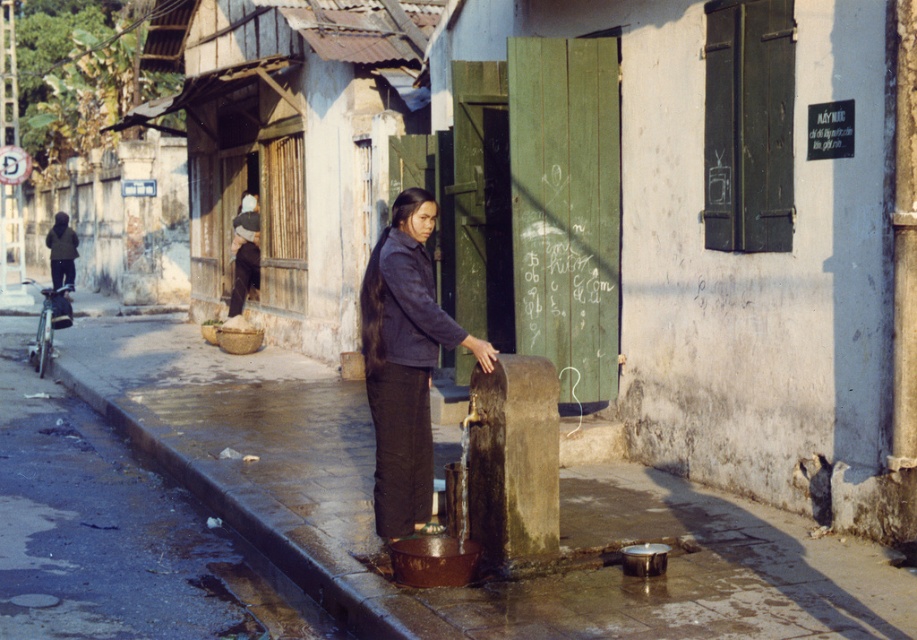
You are standing at point (429, 196) and want to walk to point (290, 380). Which direction should you move in relative to the street scene?

You should move backward because point (290, 380) is behind point (429, 196) in the street scene.

You are a traveler carrying a 1.2 meter tall backpack and need to place it near the rusty metal bucket at center and dark blue fabric jacket at center. Which object should you place it next to to ensure it doesn

The dark blue fabric jacket at center is taller than the rusty metal bucket at center, so placing the backpack next to the dark blue fabric jacket at center would provide a more stable and level surface.

You are a delivery person who needs to place a package on the ground near the rusty metal bucket at center and dark blue fabric jacket at center. Which object should you place the package closer to so that it doesn not get wet from the water fountain?

You should place the package closer to the dark blue fabric jacket at center because the rusty metal bucket at center is in front of it, meaning the bucket is closer to the water fountain and might get wet.